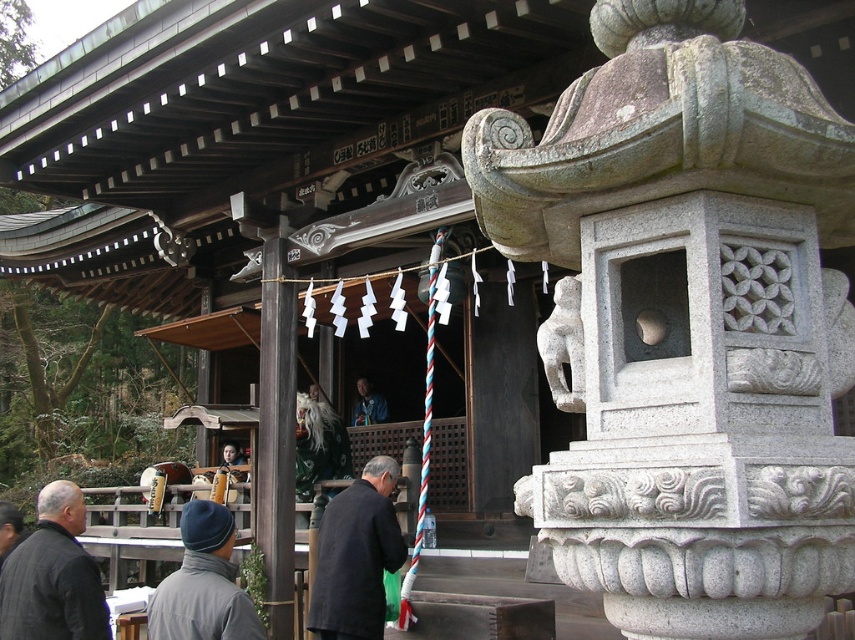
In the scene shown: You are standing at the entrance of the shrine and want to place two offerings at the specified points. The first offering must be placed at point (x=92, y=560) and the second at point (x=221, y=595). Which point should you reach first to maintain the correct order of offerings according to the shrine protocol?

You should place the offering at point (x=221, y=595) first because point (x=92, y=560) is behind it, so following the protocol requires starting from the closer point.

You are a visitor at the shrine and want to place a small offering on the altar. The altar is located behind the dark gray coat at center and dark gray wool jacket at lower left. Which object should you move to access the altar?

The dark gray coat at center is much taller than the dark gray wool jacket at lower left, so you should move the dark gray coat at center to access the altar since it is taller and blocking the path.